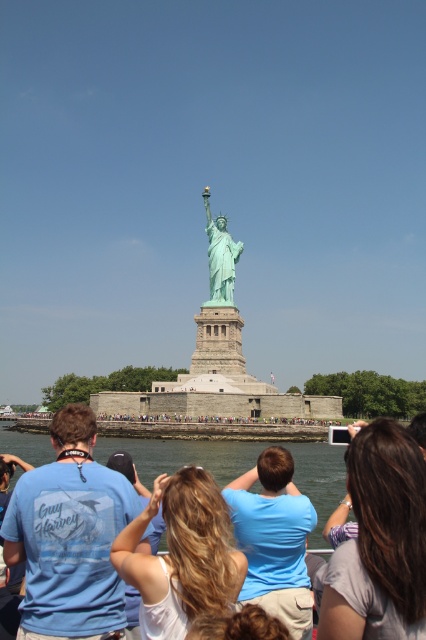
Is gray fabric shirt at lower right positioned at the back of white matte camera at center?

No.

Who is more distant from viewer, [379,568] or [123,468]?

Positioned behind is point [123,468].

Does point (417, 472) come in front of point (129, 621)?

Yes, it is in front of point (129, 621).

Find the location of a particular element. The width and height of the screenshot is (426, 640). gray fabric shirt at lower right is located at coordinates (379, 541).

Is white matte hair at center shorter than light blue t-shirt at center?

Indeed, white matte hair at center has a lesser height compared to light blue t-shirt at center.

Between point (170, 522) and point (285, 588), which one is positioned behind?

The point (285, 588) is behind.

The height and width of the screenshot is (640, 426). In order to click on white matte hair at center in this screenshot , I will do pyautogui.click(x=183, y=552).

Based on the photo, does clear water at lower center appear over brown hair at lower center?

Indeed, clear water at lower center is positioned over brown hair at lower center.

Which is in front, point (314, 461) or point (227, 634)?

Point (227, 634) is in front.

Measure the distance between point (193, 442) and camera.

A distance of 325.26 feet exists between point (193, 442) and camera.

This screenshot has height=640, width=426. Find the location of `clear water at lower center`. clear water at lower center is located at coordinates (184, 456).